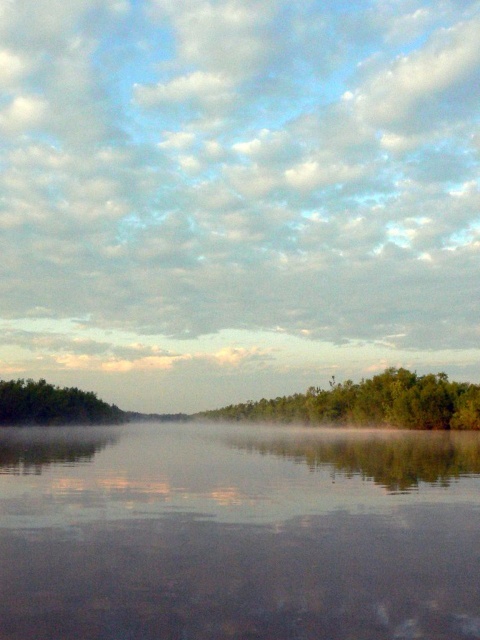
Question: Which is farther from the white misty fog at center?

Choices:
 (A) smooth reflective water at center
 (B) green leafy tree at left
 (C) green leafy trees at center

Answer: (A)

Question: Which of the following is the closest to the observer?

Choices:
 (A) (173, 604)
 (B) (22, 388)
 (C) (265, 250)

Answer: (A)

Question: Considering the relative positions of smooth reflective water at center and green leafy trees at center in the image provided, where is smooth reflective water at center located with respect to green leafy trees at center?

Choices:
 (A) above
 (B) below

Answer: (A)

Question: Which point appears closest to the camera in this image?

Choices:
 (A) (409, 560)
 (B) (144, 346)

Answer: (A)

Question: Observing the image, what is the correct spatial positioning of green leafy trees at center in reference to green leafy tree at left?

Choices:
 (A) right
 (B) left

Answer: (A)

Question: Considering the relative positions of white misty fog at center and green leafy trees at center in the image provided, where is white misty fog at center located with respect to green leafy trees at center?

Choices:
 (A) right
 (B) left

Answer: (B)